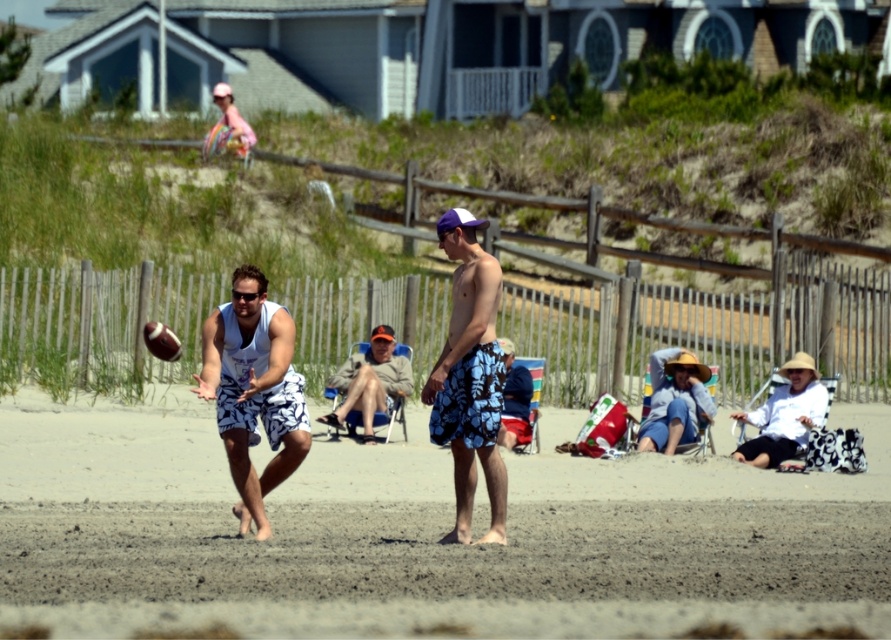
Based on the photo, you are a photographer taking a picture of the beach scene. You notice the white printed shorts at center and the matte blue shorts at center in your frame. Which pair of shorts is higher in the image?

The white printed shorts at center is located above matte blue shorts at center, so it is higher in the image.

You are a photographer trying to capture the action of the football game on the beach. You want to position your camera so that the white printed shorts at center is in the center of the frame. What coordinates should you aim for?

The white printed shorts at center is located at coordinates point (252,390), so you should aim your camera at those coordinates to center it in the frame.